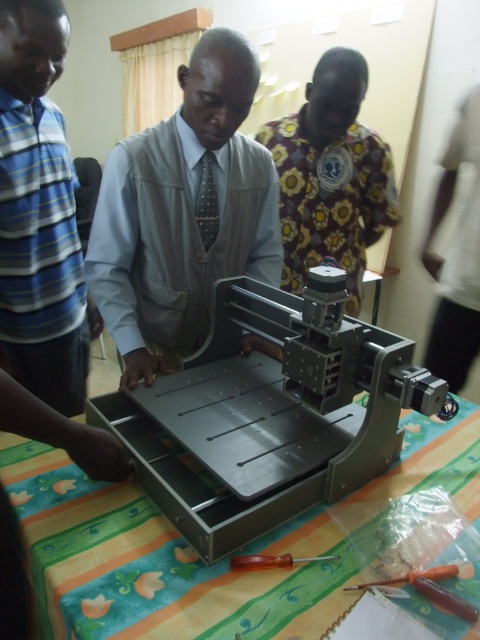
Question: Is metallic gray machine at center thinner than multicolored fabric tablecloth at center?

Choices:
 (A) no
 (B) yes

Answer: (B)

Question: Which of the following is the farthest from the observer?

Choices:
 (A) (439, 570)
 (B) (51, 161)

Answer: (B)

Question: Is floral fabric shirt at upper center wider than gray dotted tie at center?

Choices:
 (A) no
 (B) yes

Answer: (B)

Question: Which object appears farthest from the camera in this image?

Choices:
 (A) orange plastic screwdriver at center
 (B) multicolored fabric tablecloth at center
 (C) floral fabric shirt at upper center

Answer: (C)

Question: In this image, where is floral fabric shirt at upper center located relative to orange plastic screwdriver at center?

Choices:
 (A) below
 (B) above

Answer: (B)

Question: Among these objects, which one is farthest from the camera?

Choices:
 (A) blue striped shirt at left
 (B) metallic gray vest at center

Answer: (A)